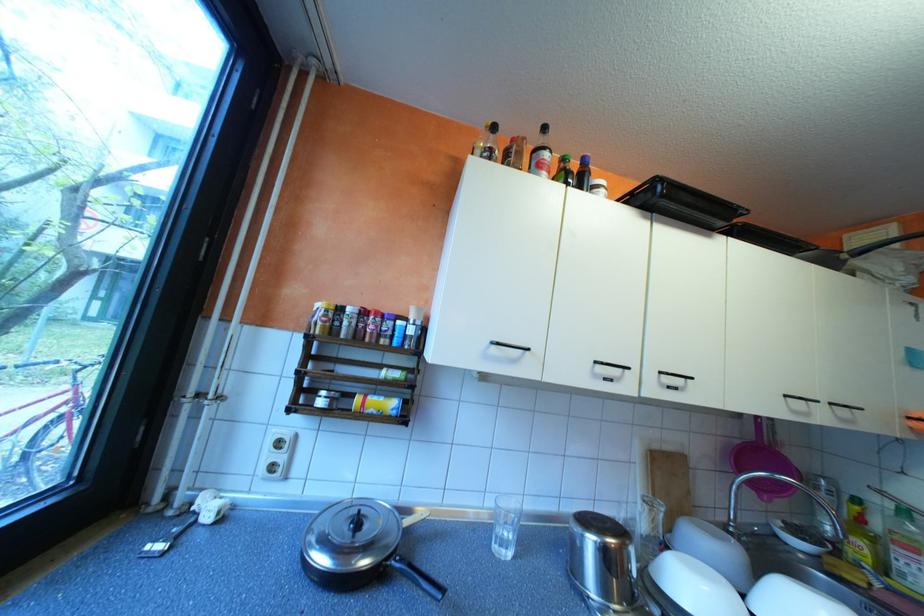
Where would you squeez the yellow soap bottle? Please return your answer as a coordinate pair (x, y).

(860, 535)